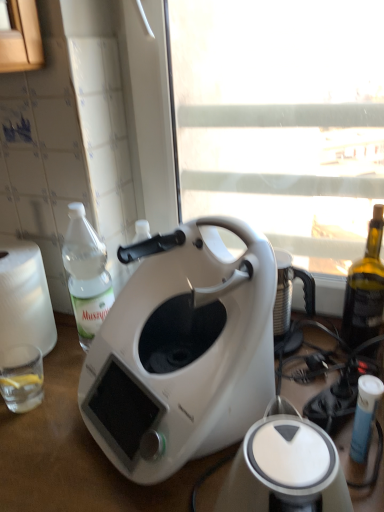
Where is `vacant area that lies between clear glass at lower left and clear plastic bottle at left`? vacant area that lies between clear glass at lower left and clear plastic bottle at left is located at coordinates (62, 377).